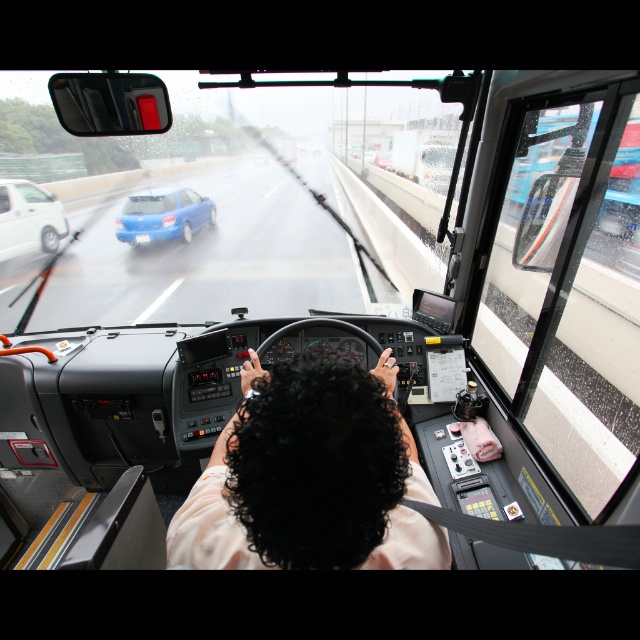
Question: Does transparent glass windshield at center come behind white matte sedan at left?

Choices:
 (A) yes
 (B) no

Answer: (B)

Question: Which of the following is the closest to the observer?

Choices:
 (A) (212, 225)
 (B) (20, 198)

Answer: (B)

Question: Can you confirm if transparent glass windshield at center is positioned below white matte sedan at left?

Choices:
 (A) no
 (B) yes

Answer: (A)

Question: Estimate the real-world distances between objects in this image. Which object is farther from the dark curly hair at center?

Choices:
 (A) transparent glass windshield at center
 (B) matte blue car at left

Answer: (A)

Question: Which point appears closest to the camera in this image?

Choices:
 (A) (404, 308)
 (B) (176, 216)
 (C) (33, 188)

Answer: (A)

Question: Is transparent glass windshield at center closer to the viewer compared to white matte sedan at left?

Choices:
 (A) no
 (B) yes

Answer: (B)